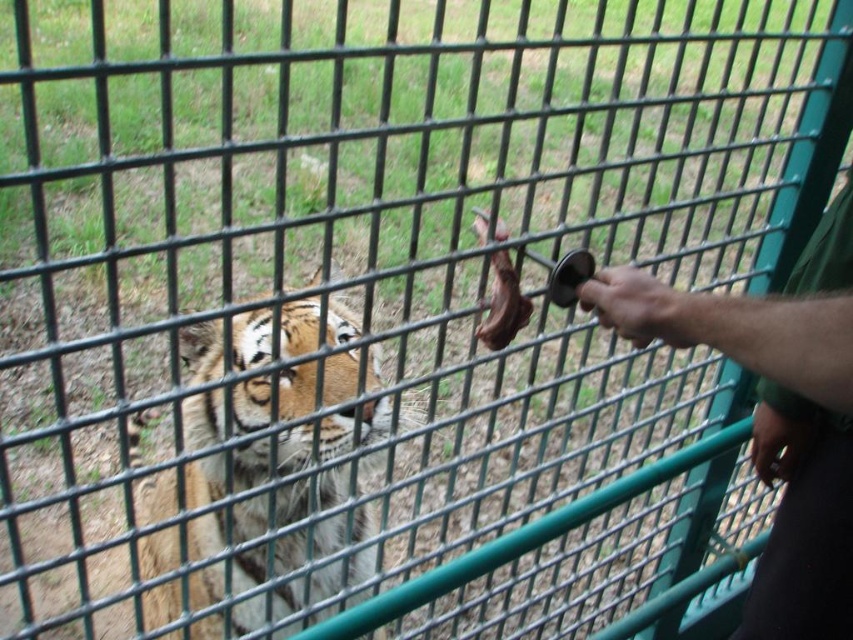
You are a zookeeper trying to feed the orange fur tiger at center with a piece of meat held by your smooth skin hand at lower right. According to the scene, which side of the tiger should you present the meat to ensure it can reach it?

The orange fur tiger at center is positioned on the left side of smooth skin hand at lower right. Therefore, you should present the meat to the tiger on the left side so it can reach it with its mouth.